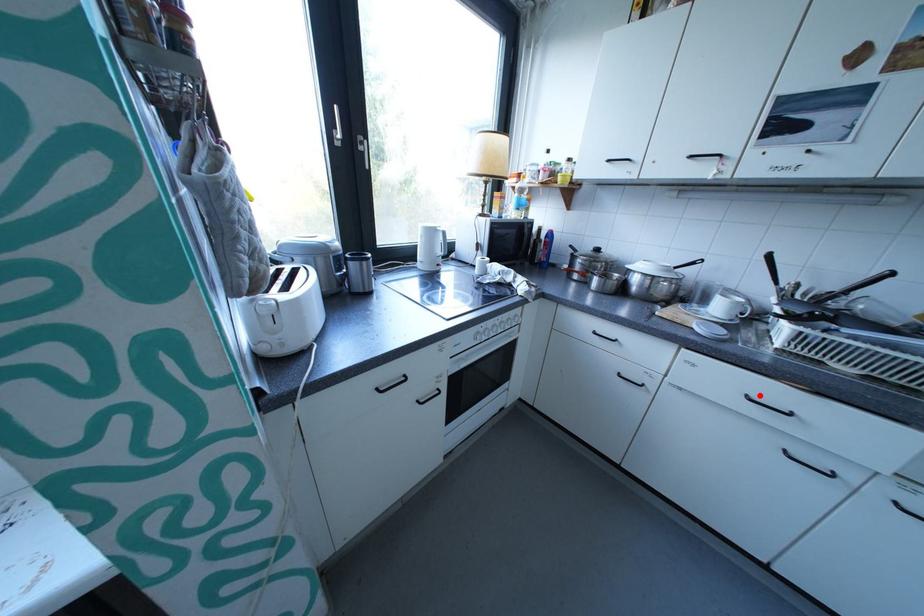
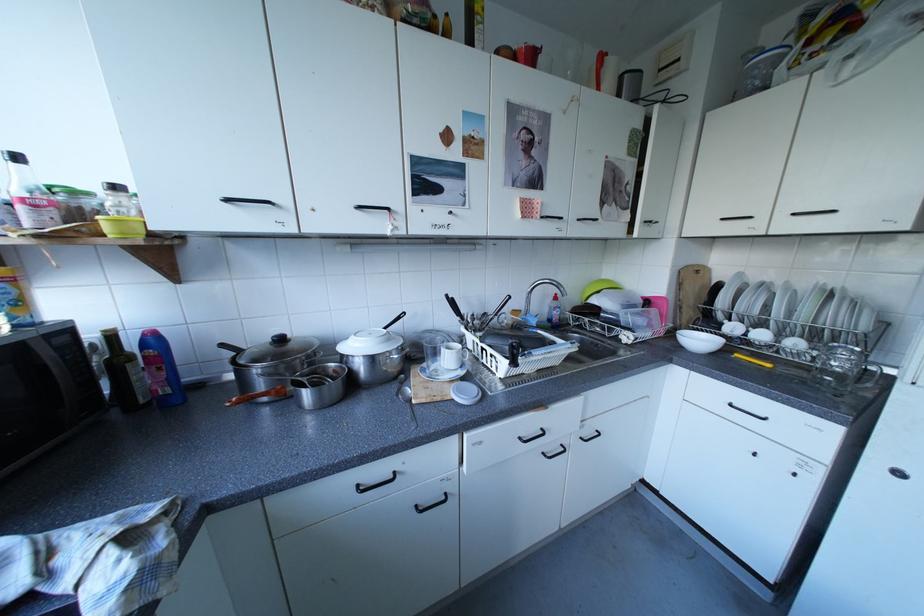
Question: A red point is marked in image1. In image2, is the corresponding 3D point closer to the camera or farther? Reply with the corresponding letter.

Choices:
 (A) The corresponding 3D point is closer.
 (B) The corresponding 3D point is farther.

Answer: (B)